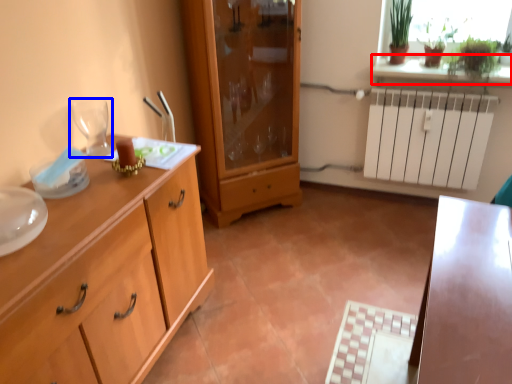
Question: Which point is further to the camera, window sill (highlighted by a red box) or wine glass (highlighted by a blue box)?

Choices:
 (A) window sill
 (B) wine glass

Answer: (A)